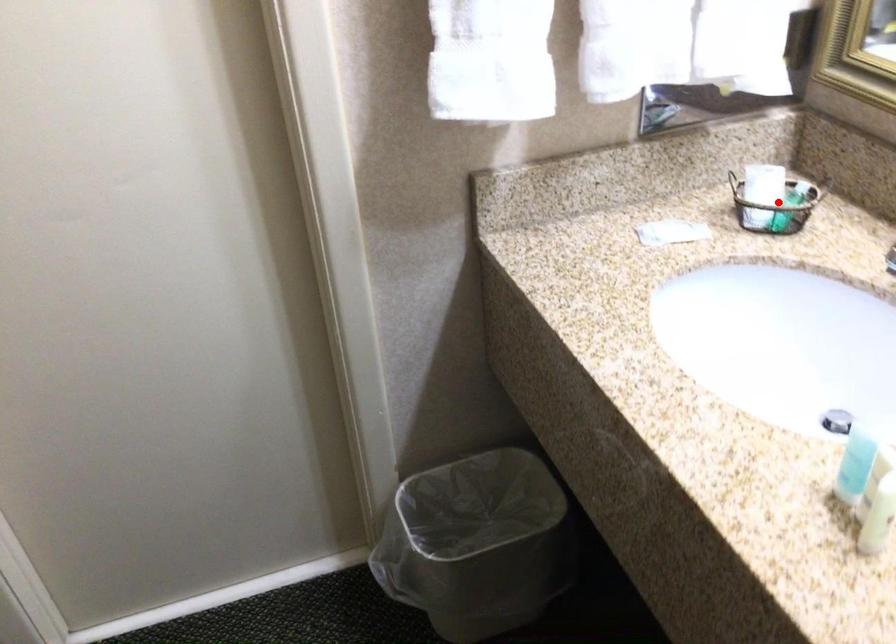
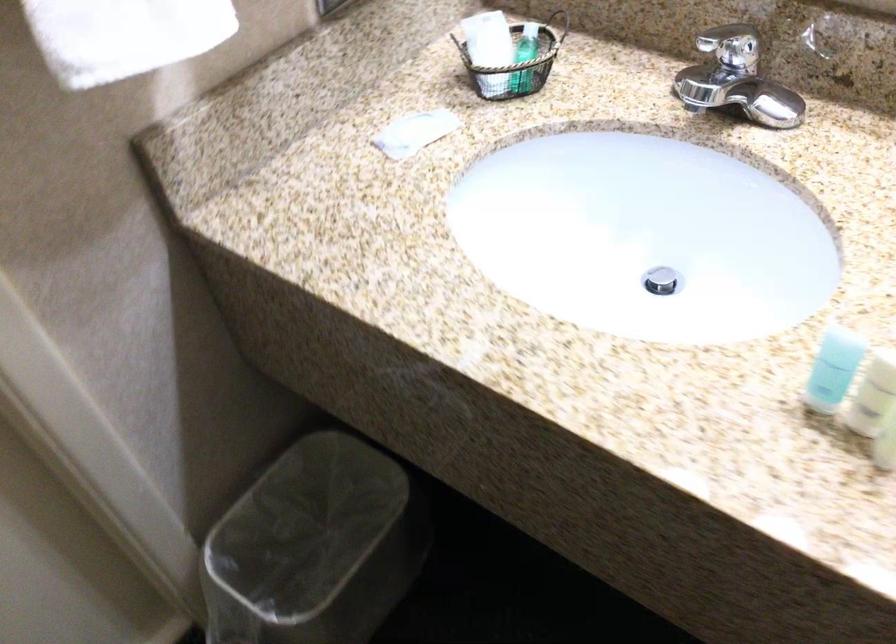
Question: I am providing you with two images of the same scene from different viewpoints. In image1, a red point is highlighted. Considering the same 3D point in image2, which of the following is correct?

Choices:
 (A) It is closer
 (B) It is farther

Answer: (A)